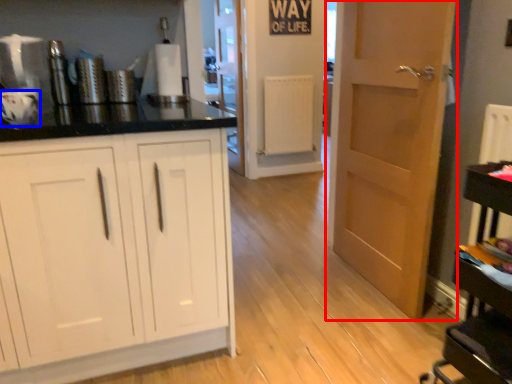
Question: Which object appears closest to the camera in this image, door (highlighted by a red box) or appliance (highlighted by a blue box)?

Choices:
 (A) door
 (B) appliance

Answer: (B)